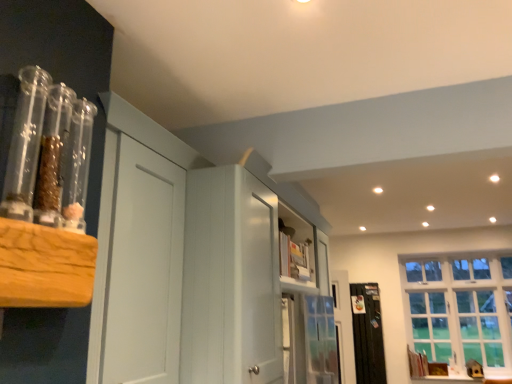
This screenshot has width=512, height=384. Describe the element at coordinates (368, 334) in the screenshot. I see `black matte radiator at right` at that location.

The image size is (512, 384). What do you see at coordinates (186, 264) in the screenshot?
I see `white painted wood cabinet at center` at bounding box center [186, 264].

Locate an element on the screen. black matte radiator at right is located at coordinates (368, 334).

Is white glass window at right with white painted wood cabinet at center?

No, white glass window at right is not touching white painted wood cabinet at center.

Based on the photo, from the image's perspective, is white glass window at right located above or below white painted wood cabinet at center?

From the image's perspective, white glass window at right appears below white painted wood cabinet at center.

Is point (447, 280) behind point (108, 341)?

That is True.

Is white painted wood cabinet at center facing towards black matte radiator at right?

No, white painted wood cabinet at center is not aimed at black matte radiator at right.

Is white painted wood cabinet at center in front of or behind black matte radiator at right in the image?

Clearly, white painted wood cabinet at center is in front of black matte radiator at right.

In terms of size, does white painted wood cabinet at center appear bigger or smaller than black matte radiator at right?

Clearly, white painted wood cabinet at center is larger in size than black matte radiator at right.

From a real-world perspective, is black matte radiator at right above or below white glass window at right?

black matte radiator at right is situated lower than white glass window at right in the real world.

Can you tell me how much black matte radiator at right and white glass window at right differ in facing direction?

They differ by 151 degrees in their facing directions.

Who is smaller, black matte radiator at right or white glass window at right?

With smaller size is black matte radiator at right.

Is black matte radiator at right far from white glass window at right?

black matte radiator at right is near white glass window at right, not far away.

Which is in front, white glass window at right or black matte radiator at right?

white glass window at right is in front.

Is black matte radiator at right at the back of white glass window at right?

That's not correct — white glass window at right is not looking away from black matte radiator at right.

Looking at their sizes, would you say white glass window at right is wider or thinner than black matte radiator at right?

In the image, white glass window at right appears to be wider than black matte radiator at right.

Could you tell me if white painted wood cabinet at center is turned towards white glass window at right?

No, white painted wood cabinet at center is not aimed at white glass window at right.

The image size is (512, 384). I want to click on dresser above the white glass window at right (from a real-world perspective), so click(x=186, y=264).

Considering the relative sizes of white painted wood cabinet at center and white glass window at right in the image provided, is white painted wood cabinet at center bigger than white glass window at right?

Yes.

Is black matte radiator at right positioned beyond the bounds of white painted wood cabinet at center?

Yes, black matte radiator at right is outside of white painted wood cabinet at center.

Is black matte radiator at right at the left side of white painted wood cabinet at center?

No.

Which is farther, (362,363) or (108,340)?

The point (362,363) is more distant.

Image resolution: width=512 pixels, height=384 pixels. I want to click on dresser that is on the left side of white glass window at right, so click(x=186, y=264).

I want to click on dresser above the black matte radiator at right (from a real-world perspective), so click(x=186, y=264).

From the picture: Based on their spatial positions, is white painted wood cabinet at center or white glass window at right further from black matte radiator at right?

white painted wood cabinet at center lies further to black matte radiator at right than the other object.

From the image, which object appears to be farther from white glass window at right, white painted wood cabinet at center or black matte radiator at right?

The object further to white glass window at right is white painted wood cabinet at center.

From the image, which object appears to be farther from black matte radiator at right, white glass window at right or white painted wood cabinet at center?

The object further to black matte radiator at right is white painted wood cabinet at center.

Looking at the image, which one is located further to white painted wood cabinet at center, black matte radiator at right or white glass window at right?

white glass window at right is further to white painted wood cabinet at center.

Estimate the real-world distances between objects in this image. Which object is closer to white painted wood cabinet at center, white glass window at right or black matte radiator at right?

black matte radiator at right lies closer to white painted wood cabinet at center than the other object.

Considering their positions, is black matte radiator at right positioned closer to white glass window at right than white painted wood cabinet at center?

black matte radiator at right is positioned closer to the anchor white glass window at right.

Locate an element on the screen. window between white painted wood cabinet at center and black matte radiator at right along the z-axis is located at coordinates (460, 308).